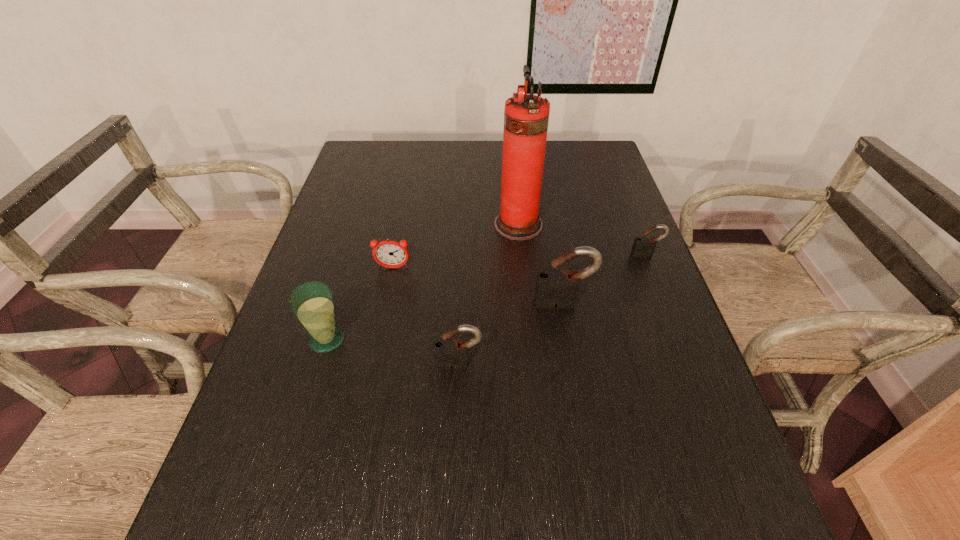
What are the coordinates of `object that is positioned at the left edge` in the screenshot? It's located at (312, 303).

You are a GUI agent. You are given a task and a screenshot of the screen. Output one action in this format:
    pyautogui.click(x=<x>, y=<y>)
    Task: Click on the object that is at the right edge
    
    Given the screenshot: What is the action you would take?
    pyautogui.click(x=642, y=245)

Where is `free region at the far edge of the desktop`? The height and width of the screenshot is (540, 960). free region at the far edge of the desktop is located at coordinates (408, 150).

In the image, there is a desktop. Identify the location of free space at the left edge. (246, 430).

I want to click on vacant space at the right edge, so click(596, 195).

The width and height of the screenshot is (960, 540). In the image, there is a desktop. What are the coordinates of `vacant space at the far left corner` in the screenshot? It's located at (396, 144).

In the image, there is a desktop. Where is `free space at the near right corner`? free space at the near right corner is located at coordinates (653, 465).

Identify the location of vacant point located between the fire extinguisher and the alarm clock. Image resolution: width=960 pixels, height=540 pixels. (456, 246).

You are a GUI agent. You are given a task and a screenshot of the screen. Output one action in this format:
    pyautogui.click(x=<x>, y=<y>)
    Task: Click on the vacant space that's between the fourth farthest object and the fourth nearest object
    
    Given the screenshot: What is the action you would take?
    pyautogui.click(x=478, y=286)

Where is `free space between the fourth tallest object and the second nearest object`? This screenshot has width=960, height=540. free space between the fourth tallest object and the second nearest object is located at coordinates (394, 352).